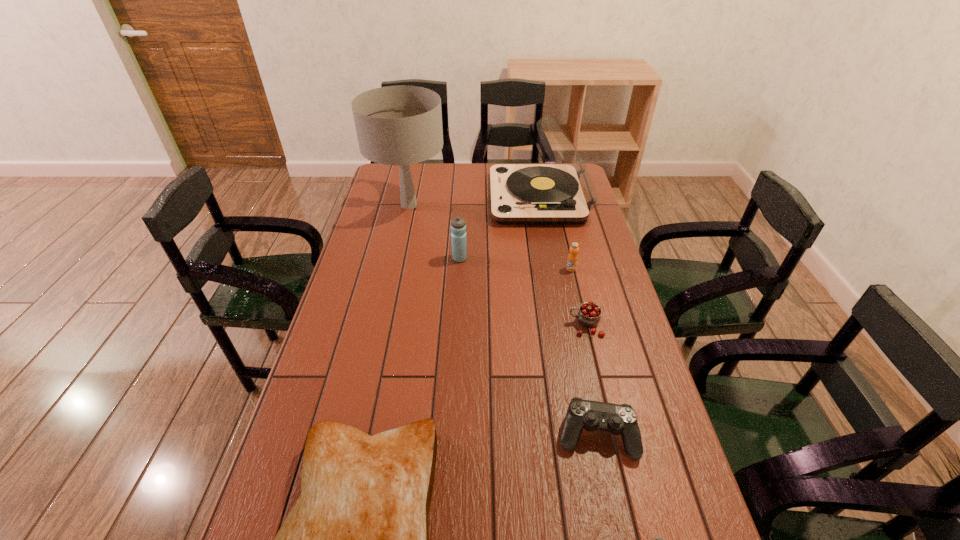
This screenshot has width=960, height=540. Find the location of `free spot between the control and the orange juice`. free spot between the control and the orange juice is located at coordinates (584, 352).

You are a GUI agent. You are given a task and a screenshot of the screen. Output one action in this format:
    pyautogui.click(x=<x>, y=<y>)
    Task: Click on the vacant space in between the orange juice and the cherry
    The height and width of the screenshot is (540, 960).
    Given the screenshot: What is the action you would take?
    pyautogui.click(x=578, y=297)

Locate an element on the screen. This screenshot has height=540, width=960. free space that is in between the control and the orange juice is located at coordinates (584, 352).

Find the location of `empty location between the cherry and the water bottle`. empty location between the cherry and the water bottle is located at coordinates (522, 292).

Where is `vacant area between the water bottle and the orange juice`? The width and height of the screenshot is (960, 540). vacant area between the water bottle and the orange juice is located at coordinates (516, 264).

At what (x,y) coordinates should I click in order to perform the action: click on vacant space that's between the record player and the orange juice. Please return your answer as a coordinate pair (x, y). This screenshot has height=540, width=960. Looking at the image, I should click on (555, 234).

The width and height of the screenshot is (960, 540). I want to click on object that stands as the second closest to the orange juice, so click(562, 192).

Locate which object ranks fifth in proximity to the control. Please provide its 2D coordinates. Your answer should be formatted as a tuple, i.e. [(x, y)], where the tuple contains the x and y coordinates of a point satisfying the conditions above.

[(458, 225)]

Identify the location of vacant position in the image that satisfies the following two spatial constraints: 1. on the handle side of the fifth farthest object; 2. on the front-facing side of the tallest object. Image resolution: width=960 pixels, height=540 pixels. (557, 205).

This screenshot has height=540, width=960. Identify the location of blank area in the image that satisfies the following two spatial constraints: 1. on the handle side of the fourth nearest object; 2. on the front-facing side of the tallest object. (557, 205).